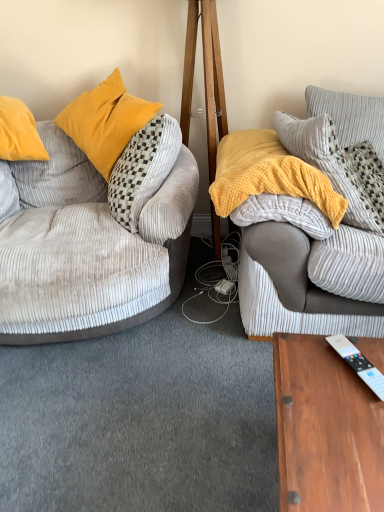
Question: Should I look upward or downward to see corduroy pillow at upper right, the second pillow from the bottom?

Choices:
 (A) down
 (B) up

Answer: (B)

Question: Is soft gray corduroy couch at right, the second studio couch from the left, outside of velvet grey couch at left, which is the first studio couch from left to right?

Choices:
 (A) yes
 (B) no

Answer: (A)

Question: From a real-world perspective, is soft gray corduroy couch at right, marked as the 1th studio couch in a right-to-left arrangement, on velvet grey couch at left, which is the first studio couch from left to right?

Choices:
 (A) no
 (B) yes

Answer: (B)

Question: Can you confirm if soft gray corduroy couch at right, the second studio couch from the left, is smaller than velvet grey couch at left, the 2th studio couch in the right-to-left sequence?

Choices:
 (A) no
 (B) yes

Answer: (B)

Question: Is soft gray corduroy couch at right, marked as the 1th studio couch in a right-to-left arrangement, at the right side of velvet grey couch at left, the 2th studio couch in the right-to-left sequence?

Choices:
 (A) no
 (B) yes

Answer: (B)

Question: Can you confirm if soft gray corduroy couch at right, the second studio couch from the left, is wider than velvet grey couch at left, which is the first studio couch from left to right?

Choices:
 (A) no
 (B) yes

Answer: (A)

Question: Considering the relative sizes of soft gray corduroy couch at right, the second studio couch from the left, and velvet grey couch at left, the 2th studio couch in the right-to-left sequence, in the image provided, is soft gray corduroy couch at right, the second studio couch from the left, thinner than velvet grey couch at left, the 2th studio couch in the right-to-left sequence,?

Choices:
 (A) no
 (B) yes

Answer: (B)

Question: Does yellow corduroy pillow at upper right, acting as the 2th pillow starting from the top, appear on the right side of white plastic remote control at lower right?

Choices:
 (A) no
 (B) yes

Answer: (B)

Question: Can you confirm if yellow corduroy pillow at upper right, acting as the 2th pillow starting from the top, is thinner than white plastic remote control at lower right?

Choices:
 (A) no
 (B) yes

Answer: (A)

Question: From a real-world perspective, is yellow corduroy pillow at upper right, which is the 1th pillow in bottom-to-top order, physically above white plastic remote control at lower right?

Choices:
 (A) no
 (B) yes

Answer: (B)

Question: Can you confirm if yellow corduroy pillow at upper right, which is the 1th pillow in bottom-to-top order, is positioned to the left of white plastic remote control at lower right?

Choices:
 (A) no
 (B) yes

Answer: (A)

Question: Does yellow corduroy pillow at upper right, acting as the 2th pillow starting from the top, touch white plastic remote control at lower right?

Choices:
 (A) no
 (B) yes

Answer: (A)

Question: From the image's perspective, is yellow corduroy pillow at upper right, acting as the 2th pillow starting from the top, beneath white plastic remote control at lower right?

Choices:
 (A) yes
 (B) no

Answer: (B)

Question: Is soft gray corduroy couch at right, marked as the 1th studio couch in a right-to-left arrangement, further to camera compared to yellow textured blanket at center?

Choices:
 (A) no
 (B) yes

Answer: (A)